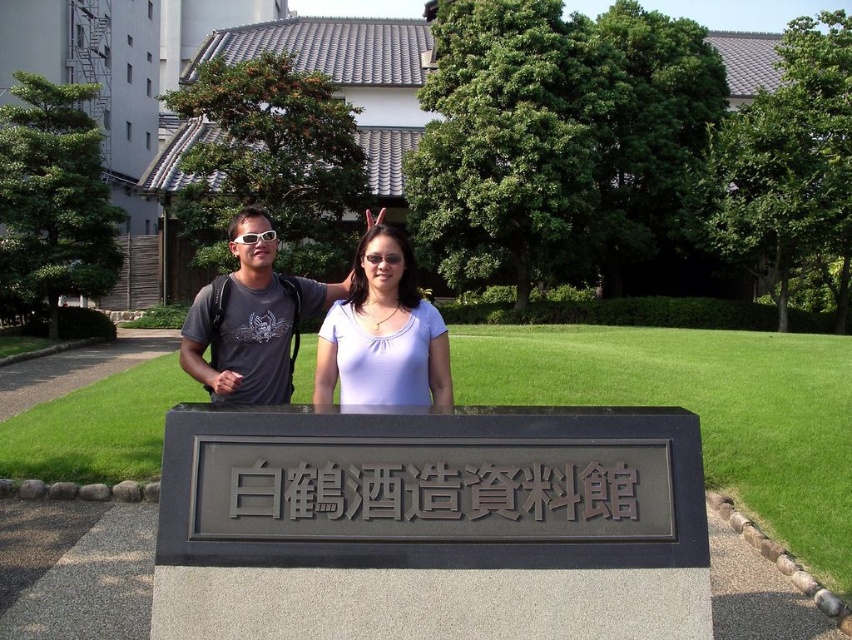
From the picture: You are a photographer trying to capture the black metal sign at center and the purple matte shirt at center in a single frame. Based on their current positions, how far apart are these two objects in inches?

The black metal sign at center is 29.62 inches away from the purple matte shirt at center.

You are a photographer trying to capture a photo of the black metal sign at center and the purple matte shirt at center. Based on their heights, which object should you focus on first if you want to ensure both are in frame without adjusting your camera angle?

The black metal sign at center is not as tall as the purple matte shirt at center, so you should focus on the purple matte shirt at center first to ensure both are in frame without adjusting your camera angle.